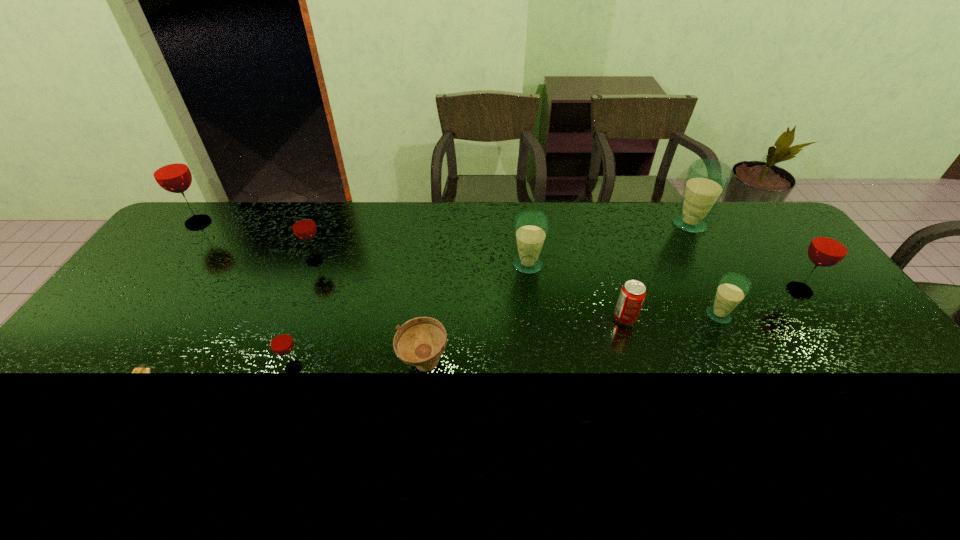
You are a GUI agent. You are given a task and a screenshot of the screen. Output one action in this format:
    pyautogui.click(x=<x>, y=<y>)
    Task: Click on the vacant space situated 0.170m on the front of the second smallest blue glass
    The image size is (960, 540).
    Given the screenshot: What is the action you would take?
    pyautogui.click(x=534, y=318)

This screenshot has height=540, width=960. What are the coordinates of `vacant region located on the right of the sixth farthest glass` in the screenshot? It's located at (778, 315).

Locate an element on the screen. Image resolution: width=960 pixels, height=540 pixels. vacant space located on the left of the nearest glass is located at coordinates (140, 368).

The width and height of the screenshot is (960, 540). I want to click on free space located on the back of the fourth object from right to left, so [x=602, y=245].

Find the location of a particular element. This screenshot has width=960, height=540. free space located on the front of the soup bowl is located at coordinates (416, 436).

Identify the location of object that is at the near edge. The width and height of the screenshot is (960, 540). (141, 368).

The image size is (960, 540). Identify the location of object located in the left edge section of the desktop. (170, 171).

The image size is (960, 540). I want to click on object situated at the right edge, so point(830,246).

The width and height of the screenshot is (960, 540). Identify the location of object that is at the far left corner. (170, 171).

Where is `vacant space at the far edge`? This screenshot has width=960, height=540. vacant space at the far edge is located at coordinates (269, 223).